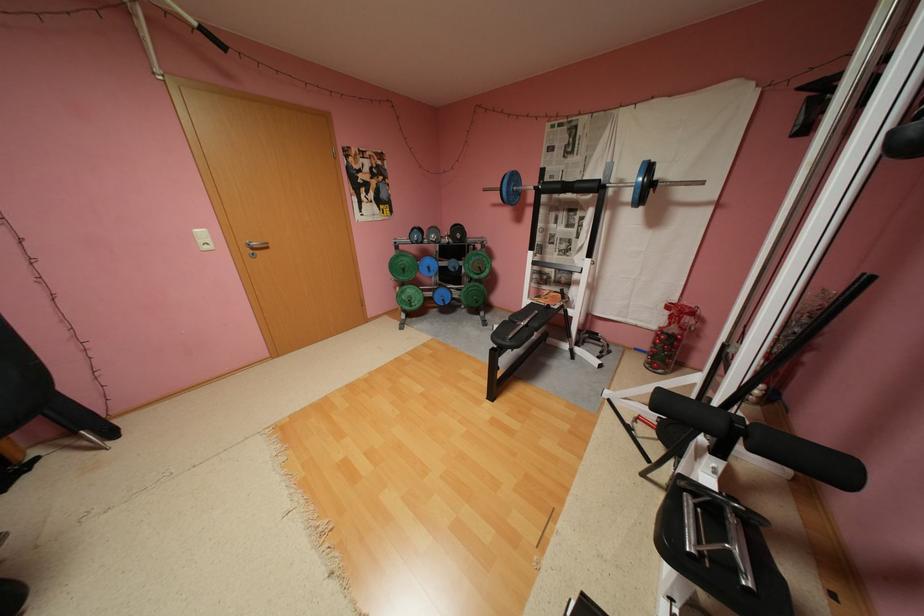
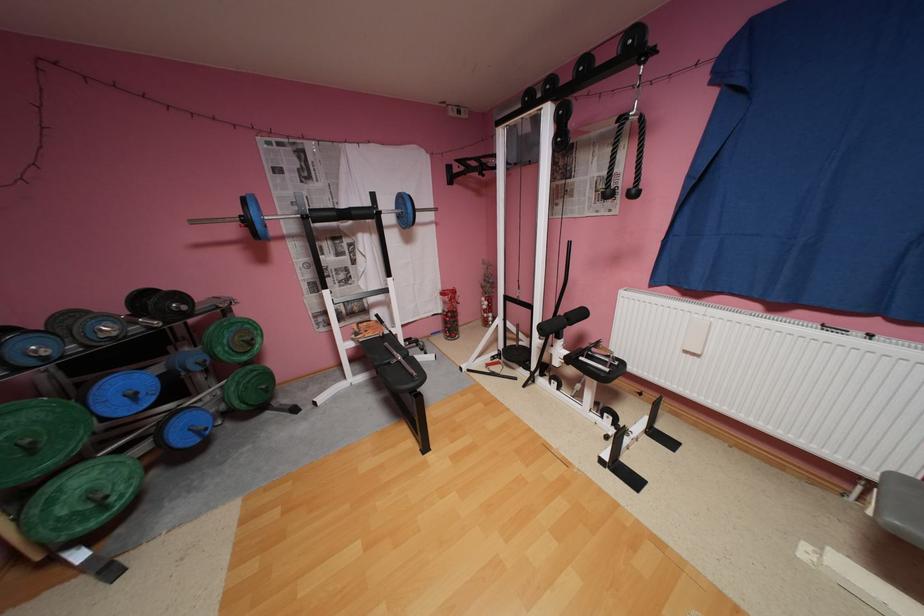
Locate, in the second image, the point that corresponds to pixel 493 190 in the first image.

(202, 223)